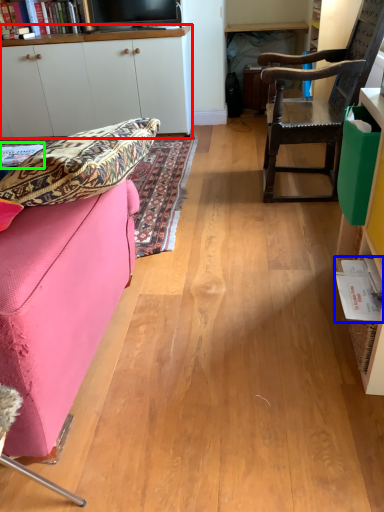
Question: Which object is the closest to the cabinetry (highlighted by a red box)? Choose among these: book (highlighted by a blue box) or book (highlighted by a green box).

Choices:
 (A) book
 (B) book

Answer: (B)